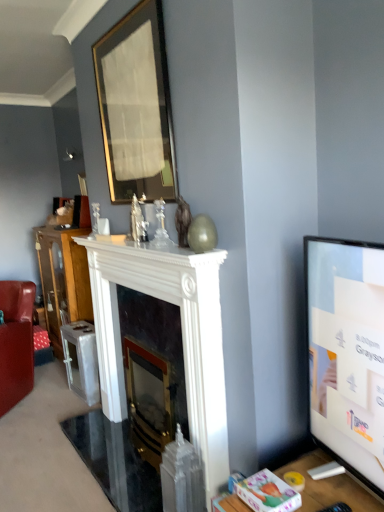
Question: In which direction should I rotate to look at polished brass fireplace at center, which ranks as the first fireplace in back-to-front order?

Choices:
 (A) left
 (B) right

Answer: (A)

Question: From the image's perspective, does flat screen tv at right appear higher than polished brass fireplace at center, which ranks as the first fireplace in back-to-front order?

Choices:
 (A) yes
 (B) no

Answer: (A)

Question: Is flat screen tv at right taller than polished brass fireplace at center, the second fireplace when ordered from front to back?

Choices:
 (A) yes
 (B) no

Answer: (B)

Question: Is polished brass fireplace at center, which ranks as the first fireplace in back-to-front order, inside flat screen tv at right?

Choices:
 (A) yes
 (B) no

Answer: (B)

Question: From a real-world perspective, is flat screen tv at right under polished brass fireplace at center, which ranks as the first fireplace in back-to-front order?

Choices:
 (A) yes
 (B) no

Answer: (B)

Question: Does flat screen tv at right come behind polished brass fireplace at center, the second fireplace when ordered from front to back?

Choices:
 (A) yes
 (B) no

Answer: (B)

Question: Is flat screen tv at right with polished brass fireplace at center, the second fireplace when ordered from front to back?

Choices:
 (A) yes
 (B) no

Answer: (B)

Question: Is matte white vase at center shorter than polished brass fireplace at center, which ranks as the first fireplace in back-to-front order?

Choices:
 (A) yes
 (B) no

Answer: (A)

Question: Is matte white vase at center positioned far away from polished brass fireplace at center, the second fireplace when ordered from front to back?

Choices:
 (A) no
 (B) yes

Answer: (A)

Question: From a real-world perspective, does matte white vase at center stand above polished brass fireplace at center, which ranks as the first fireplace in back-to-front order?

Choices:
 (A) yes
 (B) no

Answer: (A)

Question: Does matte white vase at center appear on the left side of polished brass fireplace at center, the second fireplace when ordered from front to back?

Choices:
 (A) yes
 (B) no

Answer: (A)

Question: Does matte white vase at center have a larger size compared to polished brass fireplace at center, the second fireplace when ordered from front to back?

Choices:
 (A) yes
 (B) no

Answer: (B)

Question: Is the surface of matte white vase at center in direct contact with polished brass fireplace at center, which ranks as the first fireplace in back-to-front order?

Choices:
 (A) no
 (B) yes

Answer: (A)

Question: Does gold-framed mirror at upper center have a greater height compared to flat screen tv at right?

Choices:
 (A) no
 (B) yes

Answer: (B)